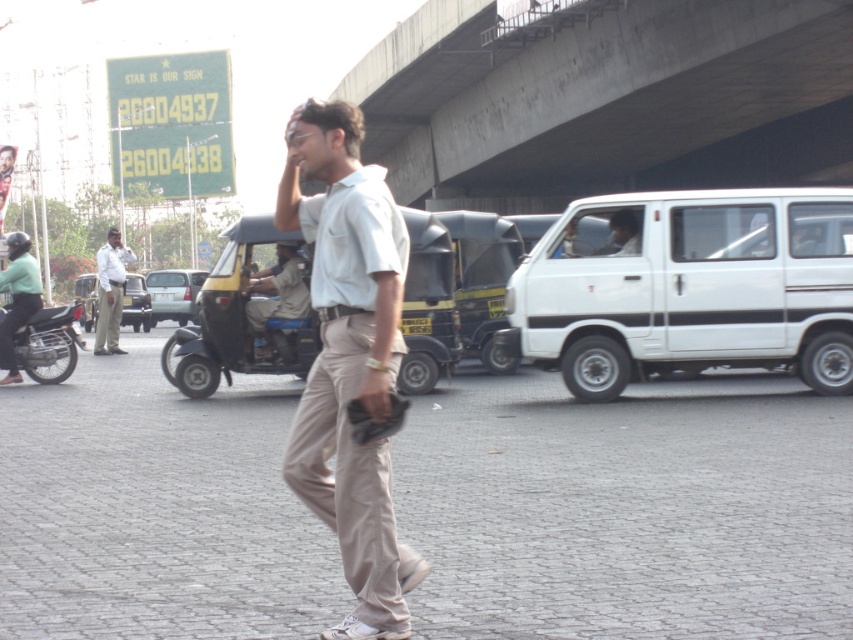
Question: Does brown stone pavement at center appear on the left side of green matte helmet at left?

Choices:
 (A) no
 (B) yes

Answer: (A)

Question: Which point is closer to the camera?

Choices:
 (A) dark blue uniform at center
 (B) light beige cotton shirt at center
 (C) concrete at upper center
 (D) green matte helmet at left

Answer: (B)

Question: Can you confirm if brown stone pavement at center is smaller than dark blue uniform at center?

Choices:
 (A) no
 (B) yes

Answer: (A)

Question: From the image, what is the correct spatial relationship of dark blue uniform at center in relation to matte black car at center?

Choices:
 (A) left
 (B) right

Answer: (B)

Question: Which point appears farthest from the camera in this image?

Choices:
 (A) (161, 291)
 (B) (103, 330)
 (C) (312, 170)

Answer: (A)

Question: Which point is closer to the camera?

Choices:
 (A) brown stone pavement at center
 (B) black matte motorcycle at left
 (C) green matte helmet at left

Answer: (A)